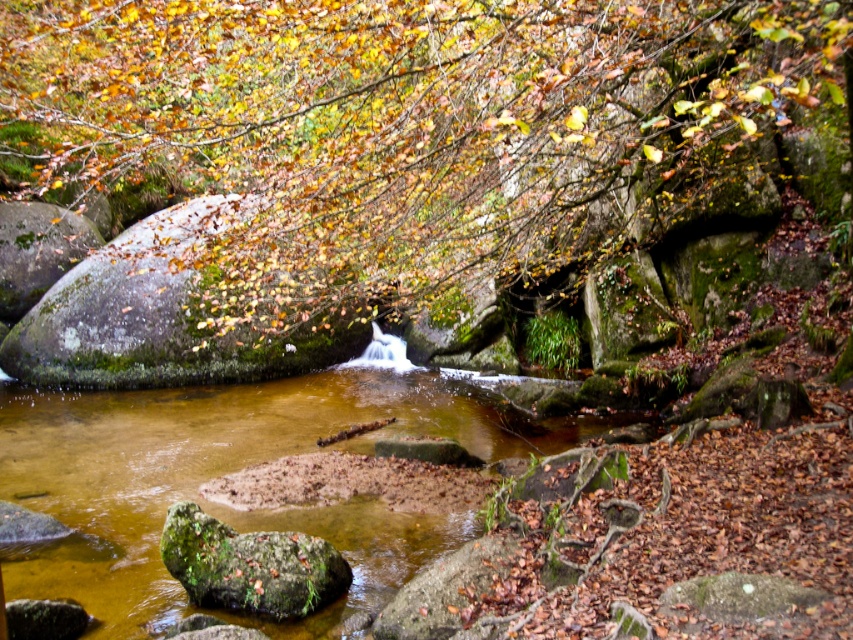
You are standing at the edge of the stream and want to place a small pebble on the closest green mossy rock. Which rock should you choose between the green mossy rock at center and the green mossy rock at upper left?

The green mossy rock at center is closer to the viewer, so you should place the pebble there.

You are standing at the origin point of the coordinate system in the image. The origin is at the bottom left corner of the image. You want to place a small decorative stone at the exact center of the image. Is the green mossy rock at center located to the left or right of the image center?

The green mossy rock at center is located to the left of the image center because its 2D coordinate is at point (415, 129), which is to the left of the center point at (426, 320).